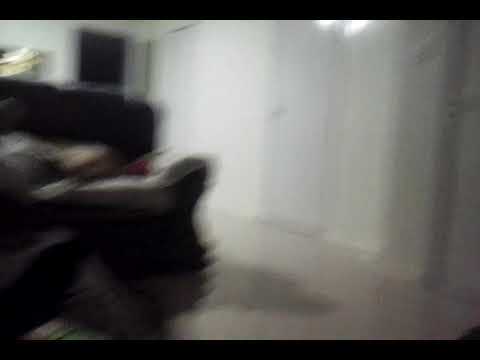
Where is `couch`? Image resolution: width=480 pixels, height=360 pixels. couch is located at coordinates (104, 108).